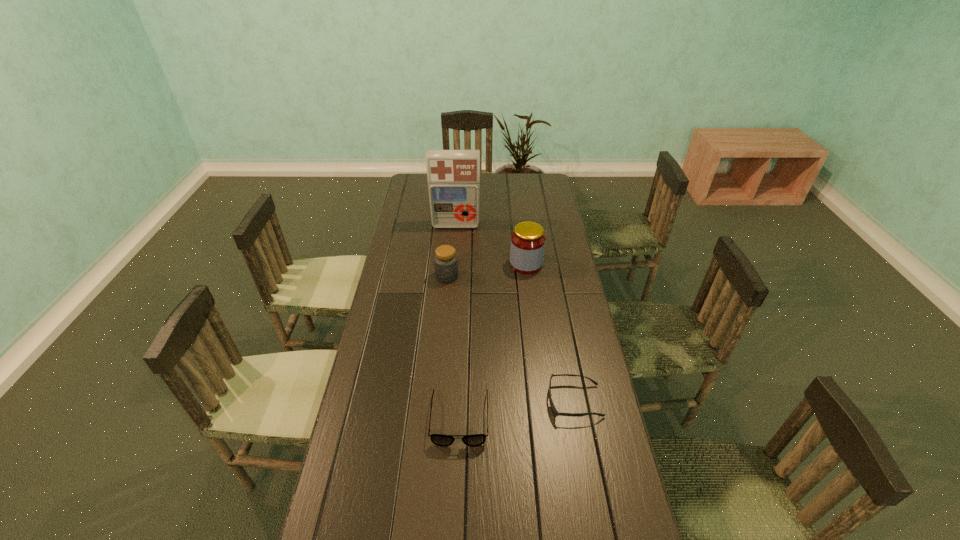
Locate an element on the screen. the tallest object is located at coordinates (453, 176).

Locate an element on the screen. The width and height of the screenshot is (960, 540). the first-aid kit is located at coordinates (453, 176).

Where is `the right jar`? Image resolution: width=960 pixels, height=540 pixels. the right jar is located at coordinates (x=527, y=247).

In order to click on the second tallest object in this screenshot , I will do `click(527, 247)`.

This screenshot has width=960, height=540. I want to click on the third shortest object, so click(446, 262).

The height and width of the screenshot is (540, 960). In order to click on the left jar in this screenshot , I will do `click(446, 262)`.

Identify the location of spectacles. The width and height of the screenshot is (960, 540). (474, 440).

Identify the location of the shortest object. Image resolution: width=960 pixels, height=540 pixels. (553, 408).

Where is `vacant space located 0.400m on the front-facing side of the tallest object`? The height and width of the screenshot is (540, 960). vacant space located 0.400m on the front-facing side of the tallest object is located at coordinates point(451,288).

Where is `vacant point located on the back of the taller jar`? This screenshot has height=540, width=960. vacant point located on the back of the taller jar is located at coordinates (519, 207).